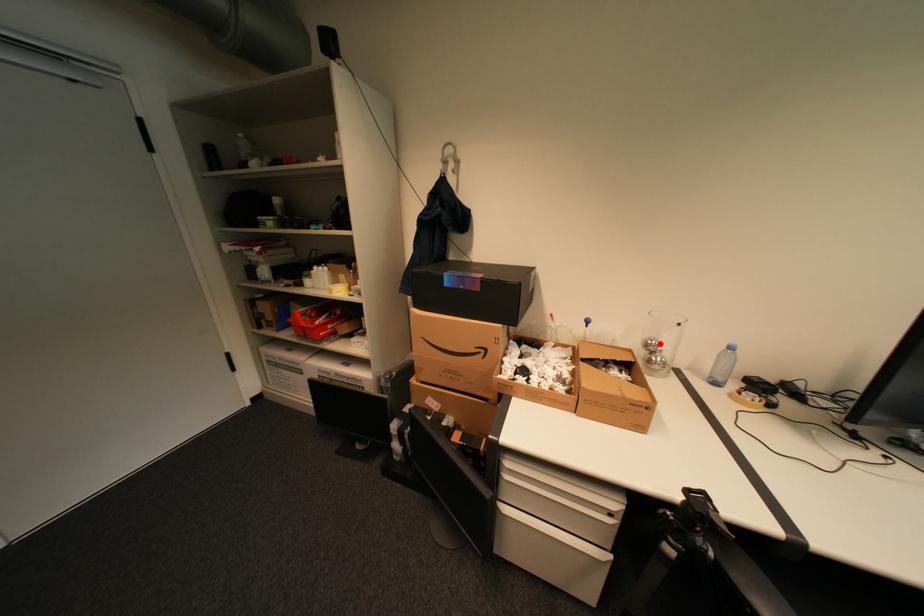
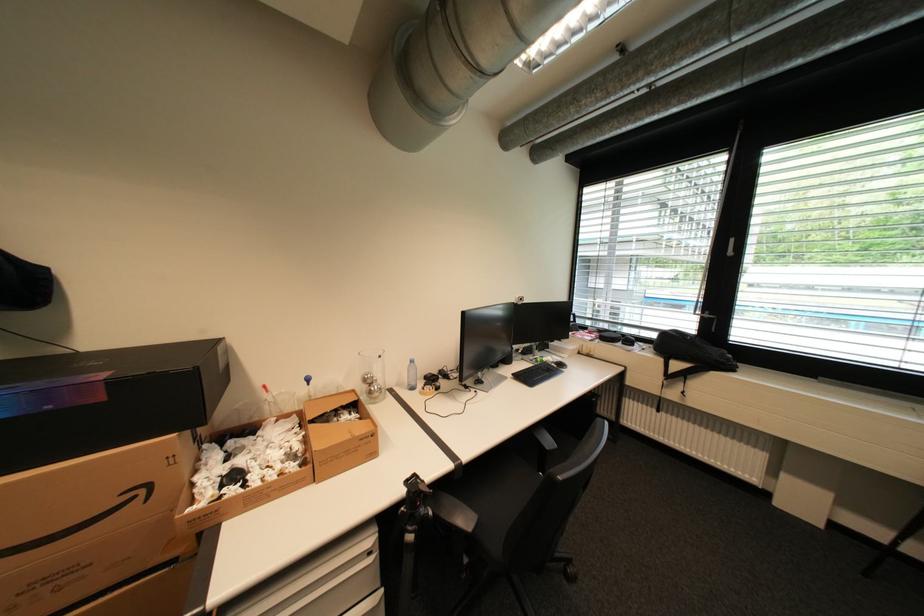
The point at the highlighted location is marked in the first image. Where is the corresponding point in the second image?

(377, 378)